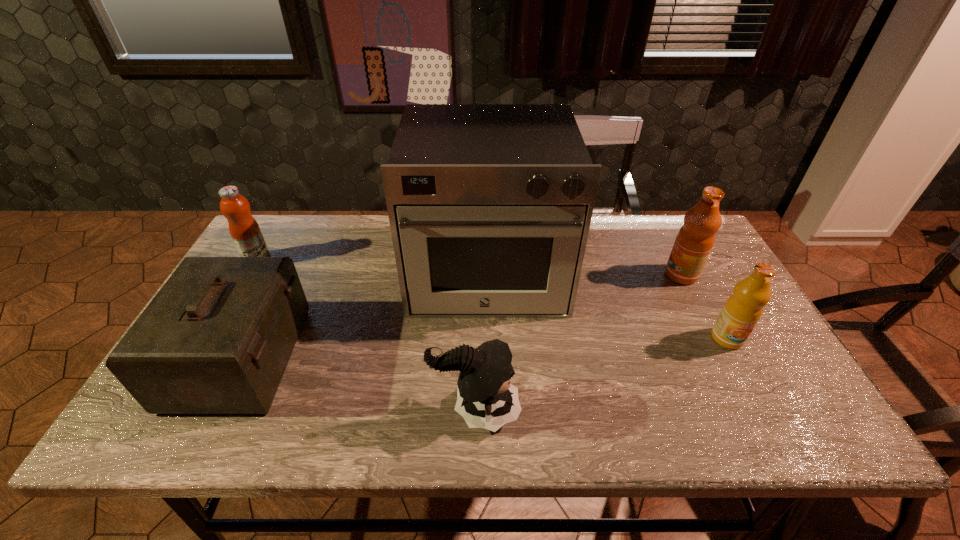
Locate an element on the screen. This screenshot has width=960, height=540. vacant point at the right edge is located at coordinates (746, 346).

Locate an element on the screen. This screenshot has height=540, width=960. unoccupied position between the tallest object and the leftmost fruit juice is located at coordinates (372, 268).

Locate an element on the screen. The height and width of the screenshot is (540, 960). free point between the tallest object and the doll is located at coordinates (481, 342).

This screenshot has height=540, width=960. I want to click on free space between the doll and the leftmost fruit juice, so click(367, 335).

At what (x,y) coordinates should I click in order to perform the action: click on vacant space in between the doll and the leftmost fruit juice. Please return your answer as a coordinate pair (x, y). Looking at the image, I should click on (367, 335).

Where is `the fifth closest object relative to the toaster oven`? The height and width of the screenshot is (540, 960). the fifth closest object relative to the toaster oven is located at coordinates (244, 229).

The height and width of the screenshot is (540, 960). What are the coordinates of `object that stands as the fourth closest to the nearest fruit juice` in the screenshot? It's located at (216, 339).

Locate an element on the screen. fruit juice that stands as the third closest to the doll is located at coordinates pos(244,229).

Point out which fruit juice is positioned as the third nearest to the tallest object. Please provide its 2D coordinates. Your answer should be formatted as a tuple, i.e. [(x, y)], where the tuple contains the x and y coordinates of a point satisfying the conditions above.

[(244, 229)]

In order to click on vacant space that satisfies the following two spatial constraints: 1. on the front label of the first-aid kit; 2. on the right side of the leftmost fruit juice in this screenshot , I will do `click(201, 358)`.